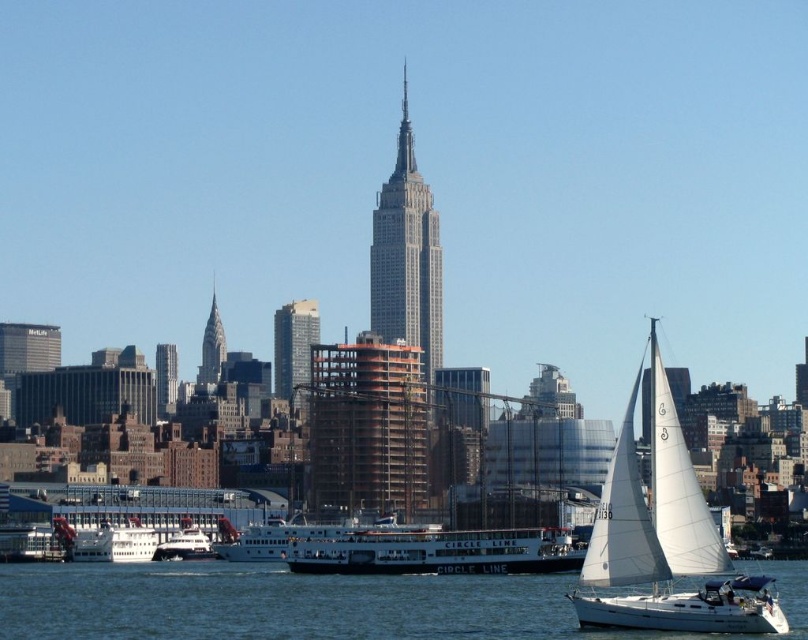
You are a photographer planning to capture the New York City skyline from a boat. You notice the clear blue water at lower center and the white matte boat at center. Which object would you focus on to ensure your camera captures the entire skyline without any obstructions?

The clear blue water at lower center is wider than the white matte boat at center, so focusing on the clear blue water at lower center would provide a broader view to capture the entire skyline without obstructions.